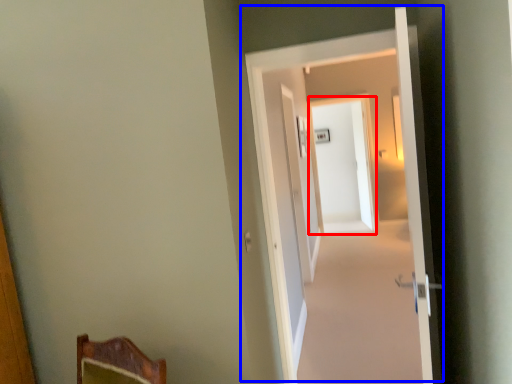
Question: Which object is further to the camera taking this photo, screen door (highlighted by a red box) or door (highlighted by a blue box)?

Choices:
 (A) screen door
 (B) door

Answer: (A)